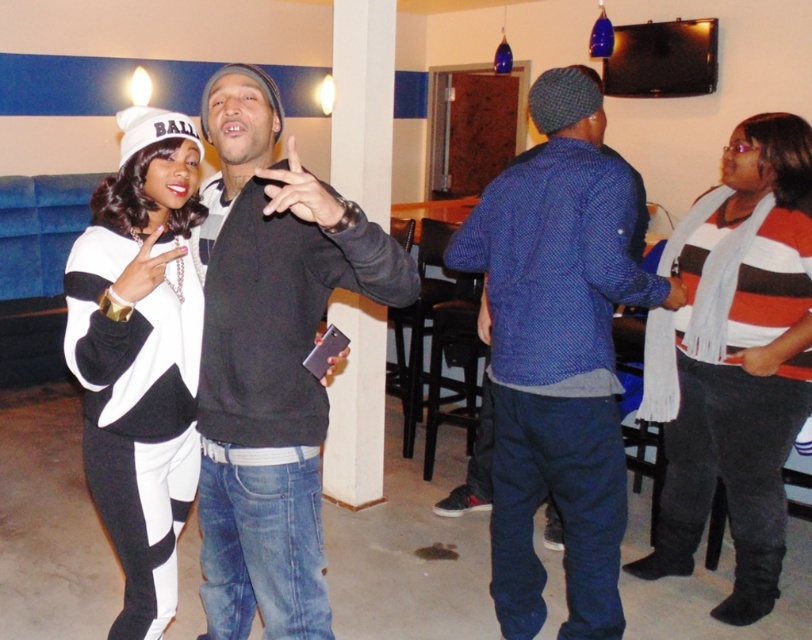
Question: Observing the image, what is the correct spatial positioning of blue textured sweater at center in reference to white matte/black sweater at left?

Choices:
 (A) below
 (B) above

Answer: (B)

Question: Which of the following is the farthest from the observer?

Choices:
 (A) (590, 268)
 (B) (683, 385)
 (C) (154, 116)
 (D) (264, 625)

Answer: (B)

Question: Which point is closer to the camera taking this photo?

Choices:
 (A) click(638, 291)
 (B) click(689, 474)
 (C) click(115, 493)

Answer: (C)

Question: Considering the relative positions of black matte sweatshirt at center and striped wool scarf at right in the image provided, where is black matte sweatshirt at center located with respect to striped wool scarf at right?

Choices:
 (A) right
 (B) left

Answer: (B)

Question: Is blue textured sweater at center closer to the viewer compared to white matte/black sweater at left?

Choices:
 (A) no
 (B) yes

Answer: (A)

Question: Based on their relative distances, which object is farther from the black matte sweatshirt at center?

Choices:
 (A) blue textured sweater at center
 (B) striped wool scarf at right
 (C) white matte/black sweater at left

Answer: (B)